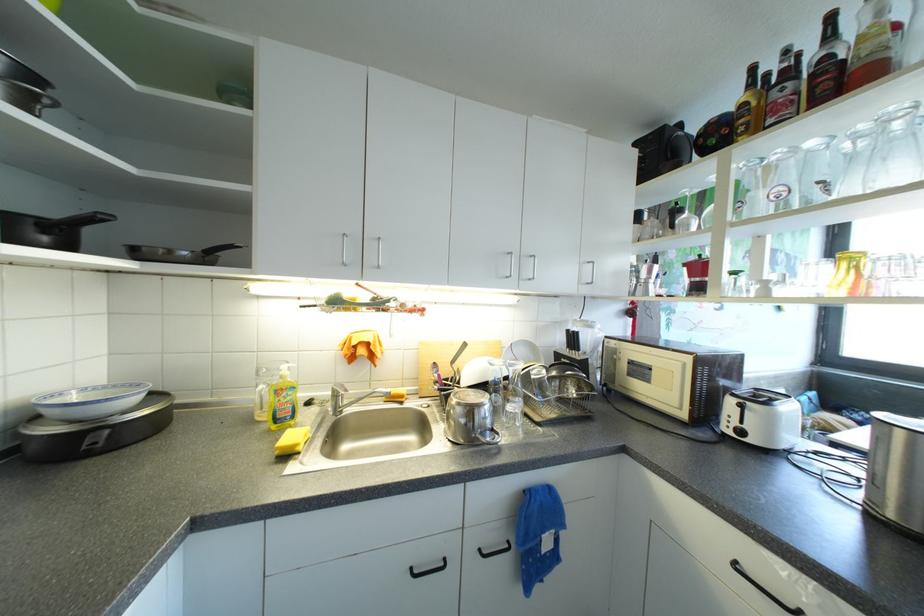
The image size is (924, 616). Describe the element at coordinates (763, 589) in the screenshot. I see `the metal kettle handle` at that location.